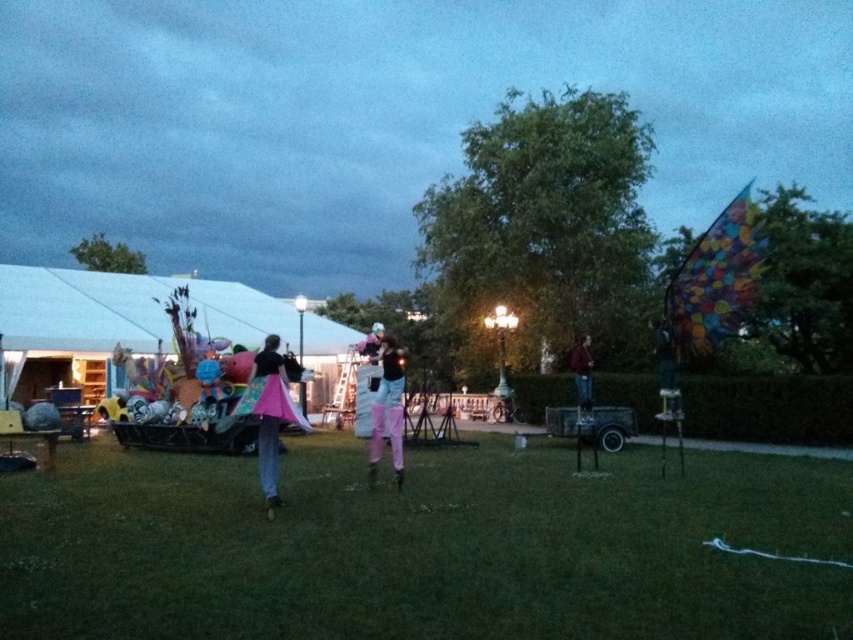
Question: Is white fabric tent at left below pink fabric pants at center?

Choices:
 (A) no
 (B) yes

Answer: (A)

Question: Is white fabric tent at left to the left of metallic silver helmet at center from the viewer's perspective?

Choices:
 (A) yes
 (B) no

Answer: (A)

Question: Which of these objects is positioned farthest from the metallic silver helmet at center?

Choices:
 (A) pink fabric kite at center
 (B) white fabric tent at left
 (C) pink fabric pants at center

Answer: (B)

Question: Which of these objects is positioned farthest from the dark blue jeans at center?

Choices:
 (A) pink fabric kite at center
 (B) metallic silver helmet at center
 (C) multicolored fabric kite at upper right

Answer: (A)

Question: Is multicolored fabric kite at upper right above dark blue jeans at center?

Choices:
 (A) no
 (B) yes

Answer: (B)

Question: Which object is the closest to the white fabric tent at left?

Choices:
 (A) dark blue jeans at center
 (B) pink fabric pants at center

Answer: (A)